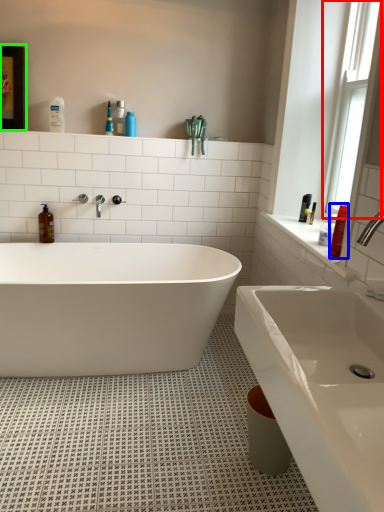
Question: Considering the real-world distances, which object is closest to window (highlighted by a red box)? toiletry (highlighted by a blue box) or medicine cabinet (highlighted by a green box).

Choices:
 (A) toiletry
 (B) medicine cabinet

Answer: (A)